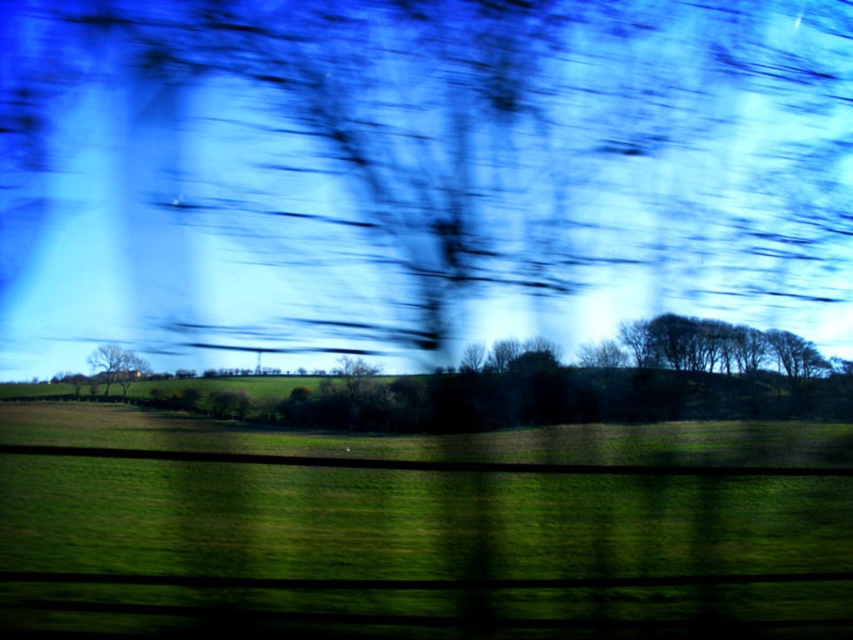
You are a passenger on a train and looking out the window. You see a point marked at coordinates (x=416, y=528). According to the image, what does this point correspond to?

The point at (x=416, y=528) corresponds to the green grassy field at lower center.

You are a passenger on a train and looking out the window. You notice two points in the scene. The first point is at coordinate point (496,596) and the second is at point (119,349). Based on your perspective inside the train, which point appears closer to you?

Point (496,596) appears closer to you because it is closer to the camera than point (119,349).